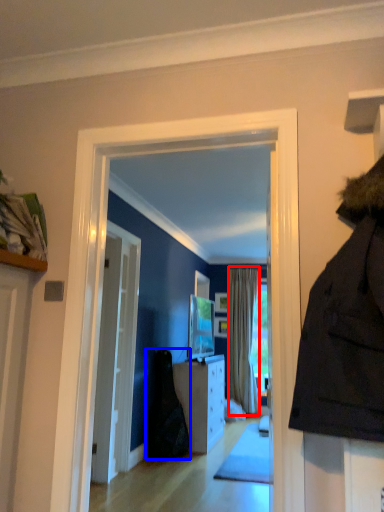
Question: Which of the following is the closest to the observer, curtain (highlighted by a red box) or dark (highlighted by a blue box)?

Choices:
 (A) curtain
 (B) dark

Answer: (B)